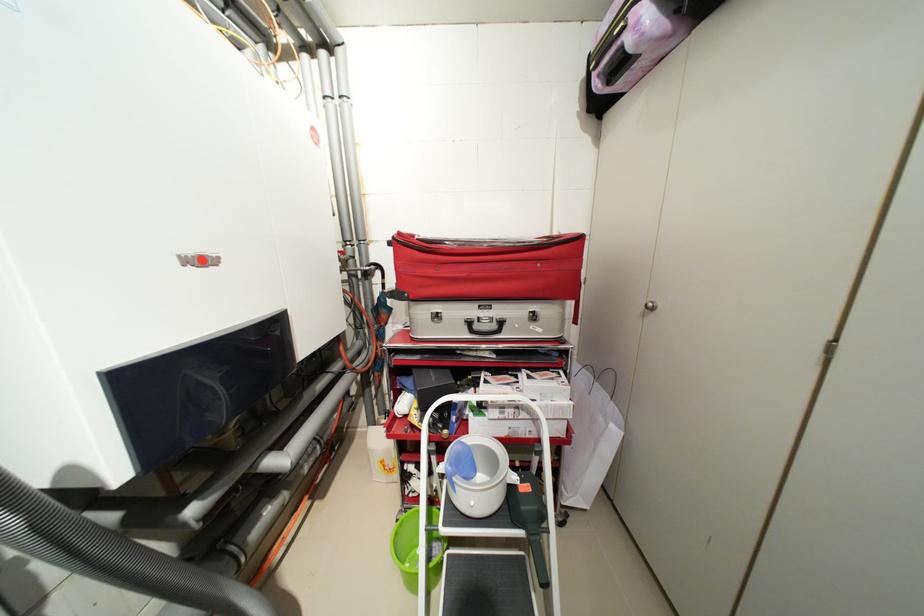
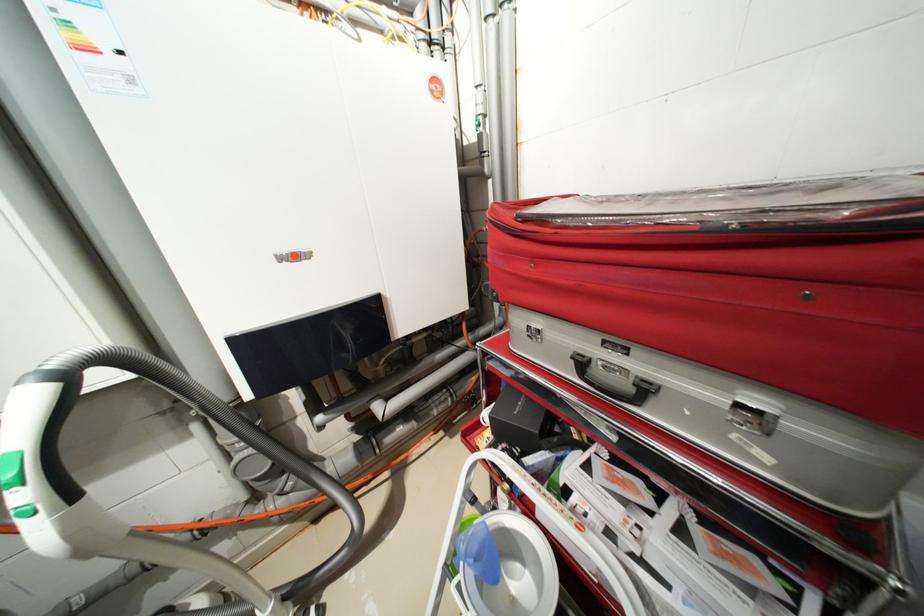
Question: Based on the continuous images, in which direction is the camera rotating? Reply with the corresponding letter.

Choices:
 (A) Left
 (B) Right
 (C) Up
 (D) Down

Answer: (A)